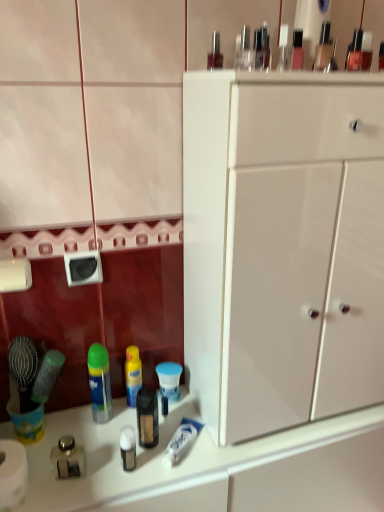
The width and height of the screenshot is (384, 512). Describe the element at coordinates (169, 380) in the screenshot. I see `blue matte toothpaste tube at lower center, acting as the 1th toiletry starting from the top` at that location.

Where is `blue matte toothpaste tube at lower center, acting as the first toiletry starting from the right`? blue matte toothpaste tube at lower center, acting as the first toiletry starting from the right is located at coordinates (169, 380).

Where is `white glossy counter top at lower left`? The image size is (384, 512). white glossy counter top at lower left is located at coordinates (215, 466).

This screenshot has height=512, width=384. What do you see at coordinates (281, 251) in the screenshot? I see `white glossy cabinet at center` at bounding box center [281, 251].

The image size is (384, 512). Identify the location of white glossy cabinet at center. (281, 251).

Describe the element at coordinates (99, 382) in the screenshot. I see `green plastic mouthwash at center` at that location.

The image size is (384, 512). In order to click on clear glass jar at lower left, marked as the 2th toiletry in a right-to-left arrangement in this screenshot , I will do `click(68, 458)`.

This screenshot has height=512, width=384. I want to click on blue matte toothpaste tube at lower center, the 2th toiletry positioned from the left, so click(169, 380).

Find the location of a particular element. The image size is (384, 512). counter top on the right of white matte toilet paper at lower left is located at coordinates (215, 466).

Is white glossy counter top at lower left wider or thinner than white matte toilet paper at lower left?

white glossy counter top at lower left is wider than white matte toilet paper at lower left.

Is white glossy counter top at lower left oriented away from white matte toilet paper at lower left?

white glossy counter top at lower left is not turned away from white matte toilet paper at lower left.

Based on their sizes in the image, would you say white glossy counter top at lower left is bigger or smaller than white matte toilet paper at lower left?

Clearly, white glossy counter top at lower left is larger in size than white matte toilet paper at lower left.

Measure the distance from green plastic mouthwash at center to white matte toilet paper at lower left.

green plastic mouthwash at center and white matte toilet paper at lower left are 10.18 inches apart from each other.

Is white matte toilet paper at lower left surrounded by green plastic mouthwash at center?

No.

At what (x,y) coordinates should I click in order to perform the action: click on mouthwash that is above the white matte toilet paper at lower left (from the image's perspective). Please return your answer as a coordinate pair (x, y). Looking at the image, I should click on (99, 382).

Who is bigger, green plastic mouthwash at center or white matte toilet paper at lower left?

white matte toilet paper at lower left.

Considering the sizes of objects white glossy cabinet at center and blue matte toothpaste tube at lower center, acting as the second toiletry starting from the bottom, in the image provided, who is bigger, white glossy cabinet at center or blue matte toothpaste tube at lower center, acting as the second toiletry starting from the bottom,?

Bigger between the two is white glossy cabinet at center.

Which object is closer to the camera, white glossy cabinet at center or blue matte toothpaste tube at lower center, acting as the first toiletry starting from the right?

white glossy cabinet at center.

From the picture: Which of these two, white glossy cabinet at center or blue matte toothpaste tube at lower center, which ranks as the 1th toiletry in back-to-front order, stands shorter?

blue matte toothpaste tube at lower center, which ranks as the 1th toiletry in back-to-front order.

Does white glossy cabinet at center appear on the left side of blue matte toothpaste tube at lower center, which ranks as the 1th toiletry in back-to-front order?

In fact, white glossy cabinet at center is to the right of blue matte toothpaste tube at lower center, which ranks as the 1th toiletry in back-to-front order.

Is green plastic mouthwash at center taller or shorter than clear glass jar at lower left, which is the 1th toiletry in left-to-right order?

In the image, green plastic mouthwash at center appears to be taller than clear glass jar at lower left, which is the 1th toiletry in left-to-right order.

Considering the sizes of green plastic mouthwash at center and clear glass jar at lower left, the first toiletry positioned from the front, in the image, is green plastic mouthwash at center wider or thinner than clear glass jar at lower left, the first toiletry positioned from the front,?

Considering their sizes, green plastic mouthwash at center looks broader than clear glass jar at lower left, the first toiletry positioned from the front.

Based on their sizes in the image, would you say green plastic mouthwash at center is bigger or smaller than clear glass jar at lower left, the 2th toiletry from the back?

green plastic mouthwash at center is bigger than clear glass jar at lower left, the 2th toiletry from the back.

Considering the positions of point (93, 388) and point (67, 460), is point (93, 388) closer or farther from the camera than point (67, 460)?

Point (93, 388) is positioned farther from the camera compared to point (67, 460).

Is blue matte toothpaste tube at lower center, which is the second toiletry in front-to-back order, spatially inside green plastic mouthwash at center, or outside of it?

blue matte toothpaste tube at lower center, which is the second toiletry in front-to-back order, cannot be found inside green plastic mouthwash at center.

Is blue matte toothpaste tube at lower center, which is the second toiletry in front-to-back order, looking in the opposite direction of green plastic mouthwash at center?

No, blue matte toothpaste tube at lower center, which is the second toiletry in front-to-back order,'s orientation is not away from green plastic mouthwash at center.

From the image's perspective, does blue matte toothpaste tube at lower center, which is the second toiletry in front-to-back order, appear lower than green plastic mouthwash at center?

Indeed, from the image's perspective, blue matte toothpaste tube at lower center, which is the second toiletry in front-to-back order, is shown beneath green plastic mouthwash at center.

Is blue matte toothpaste tube at lower center, which is the second toiletry in front-to-back order, in contact with green plastic mouthwash at center?

There is a gap between blue matte toothpaste tube at lower center, which is the second toiletry in front-to-back order, and green plastic mouthwash at center.

Is white glossy counter top at lower left facing away from green plastic mouthwash at center?

white glossy counter top at lower left does not have its back to green plastic mouthwash at center.

Considering the relative sizes of white glossy counter top at lower left and green plastic mouthwash at center in the image provided, is white glossy counter top at lower left shorter than green plastic mouthwash at center?

In fact, white glossy counter top at lower left may be taller than green plastic mouthwash at center.

In the image, is white glossy counter top at lower left positioned in front of or behind green plastic mouthwash at center?

white glossy counter top at lower left is in front of green plastic mouthwash at center.

From the image's perspective, is white glossy counter top at lower left below green plastic mouthwash at center?

Yes.

Which is nearer, (19, 442) or (380, 485)?

The point (19, 442) is closer.

Is white matte toilet paper at lower left smaller than white glossy counter top at lower left?

Indeed, white matte toilet paper at lower left has a smaller size compared to white glossy counter top at lower left.

Can you confirm if white matte toilet paper at lower left is thinner than white glossy counter top at lower left?

Yes, white matte toilet paper at lower left is thinner than white glossy counter top at lower left.

Find the location of a particular element. counter top to the right of white matte toilet paper at lower left is located at coordinates (215, 466).

I want to click on toilet paper below the green plastic mouthwash at center (from the image's perspective), so click(12, 473).

From the image, which object appears to be nearer to green plastic mouthwash at center, white matte toilet paper at lower left or clear glass jar at lower left, the 2th toiletry viewed from the top?

clear glass jar at lower left, the 2th toiletry viewed from the top, lies closer to green plastic mouthwash at center than the other object.

Looking at the image, which one is located closer to clear glass jar at lower left, the 2th toiletry viewed from the top, white matte toilet paper at lower left or blue matte toothpaste tube at lower center, which is the second toiletry in front-to-back order?

The object closer to clear glass jar at lower left, the 2th toiletry viewed from the top, is white matte toilet paper at lower left.

Based on their spatial positions, is white glossy counter top at lower left or blue matte toothpaste tube at lower center, which is the second toiletry in front-to-back order, closer to clear glass jar at lower left, which is the 1th toiletry in left-to-right order?

Based on the image, blue matte toothpaste tube at lower center, which is the second toiletry in front-to-back order, appears to be nearer to clear glass jar at lower left, which is the 1th toiletry in left-to-right order.

When comparing their distances from white matte toilet paper at lower left, does blue matte toothpaste tube at lower center, acting as the 1th toiletry starting from the top, or white glossy counter top at lower left seem closer?

white glossy counter top at lower left.

Looking at the image, which one is located closer to green plastic mouthwash at center, white glossy cabinet at center or blue matte toothpaste tube at lower center, which is the second toiletry in front-to-back order?

blue matte toothpaste tube at lower center, which is the second toiletry in front-to-back order, is positioned closer to the anchor green plastic mouthwash at center.

Based on their spatial positions, is blue matte toothpaste tube at lower center, acting as the 1th toiletry starting from the top, or white glossy counter top at lower left further from green plastic mouthwash at center?

white glossy counter top at lower left is positioned further to the anchor green plastic mouthwash at center.

In the scene shown: Considering their positions, is white matte toilet paper at lower left positioned further to green plastic mouthwash at center than white glossy counter top at lower left?

Among the two, white glossy counter top at lower left is located further to green plastic mouthwash at center.

Considering their positions, is green plastic mouthwash at center positioned closer to white matte toilet paper at lower left than blue matte toothpaste tube at lower center, acting as the 1th toiletry starting from the top?

green plastic mouthwash at center.

The image size is (384, 512). In order to click on mouthwash between clear glass jar at lower left, marked as the 2th toiletry in a right-to-left arrangement, and blue matte toothpaste tube at lower center, acting as the second toiletry starting from the bottom, in the front-back direction in this screenshot , I will do `click(99, 382)`.

Image resolution: width=384 pixels, height=512 pixels. Find the location of `mouthwash between clear glass jar at lower left, the 2th toiletry viewed from the top, and white glossy cabinet at center from left to right`. mouthwash between clear glass jar at lower left, the 2th toiletry viewed from the top, and white glossy cabinet at center from left to right is located at coordinates (99, 382).

This screenshot has width=384, height=512. I want to click on toiletry positioned between white matte toilet paper at lower left and green plastic mouthwash at center from near to far, so click(68, 458).

Locate an element on the screen. This screenshot has width=384, height=512. toiletry between blue matte toothpaste tube at lower center, acting as the 1th toiletry starting from the top, and white glossy counter top at lower left, in the vertical direction is located at coordinates (68, 458).